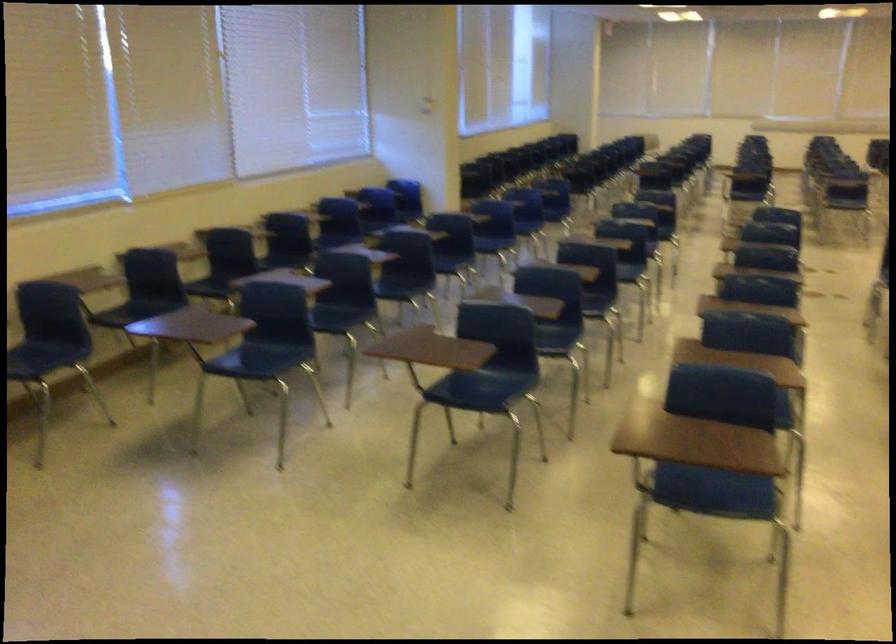
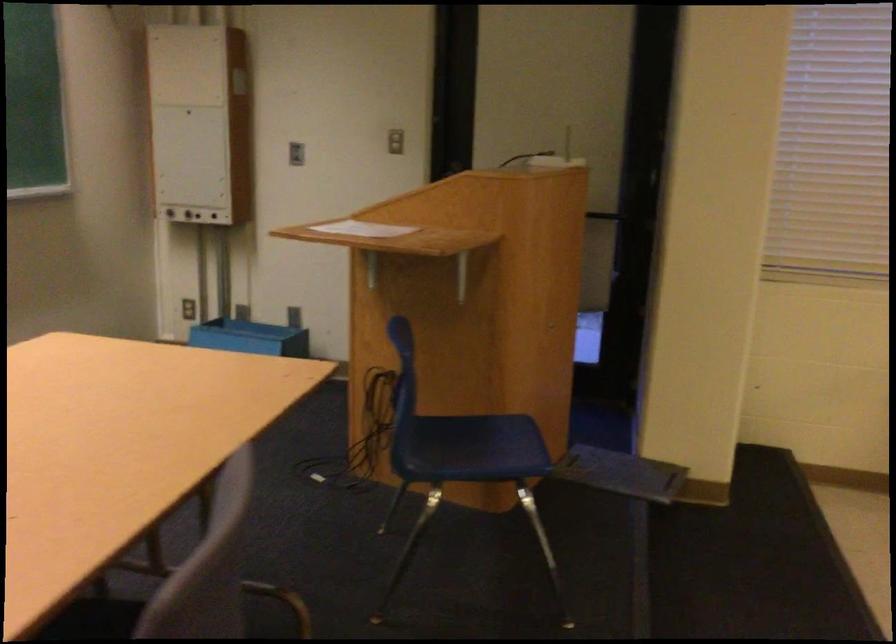
Question: The first image is from the beginning of the video and the second image is from the end. How did the camera likely rotate when shooting the video?

Choices:
 (A) Left
 (B) Right
 (C) Up
 (D) Down

Answer: (A)